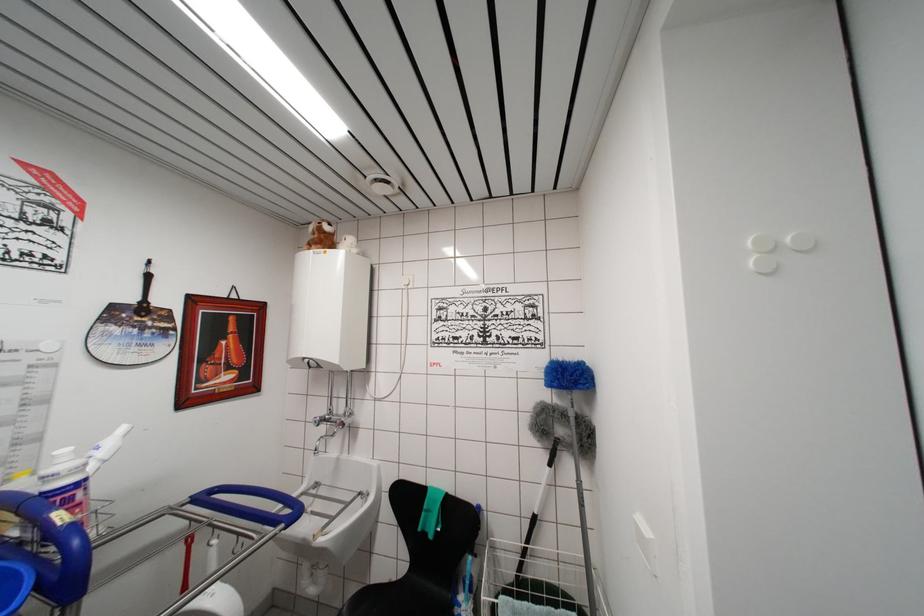
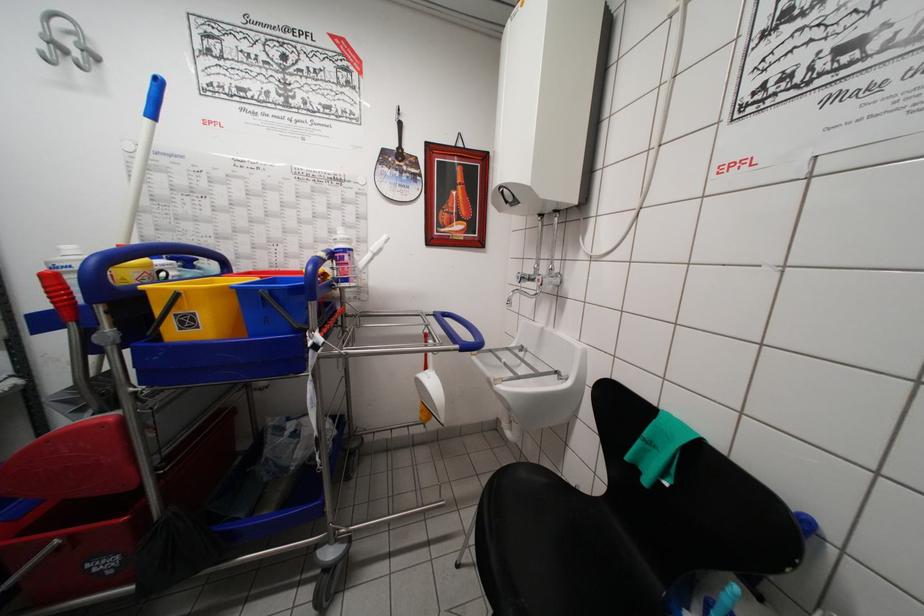
Find the pixel in the second image that matches (x=106, y=458) in the first image.

(377, 253)